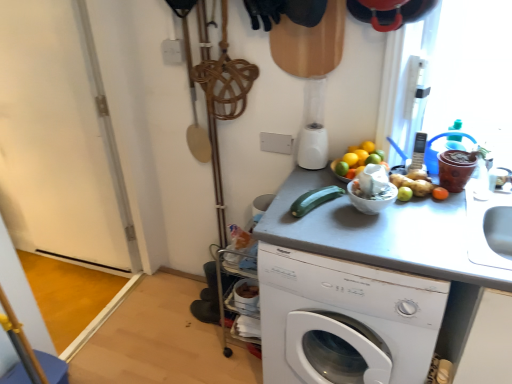
Question: In terms of width, does green matte cucumber at center look wider or thinner when compared to silver metallic phone at upper right?

Choices:
 (A) wide
 (B) thin

Answer: (A)

Question: From a real-world perspective, relative to silver metallic phone at upper right, is green matte cucumber at center vertically above or below?

Choices:
 (A) above
 (B) below

Answer: (B)

Question: Which object is the closest to the white plastic washing machine at center?

Choices:
 (A) gray matte counter top at center
 (B) green matte cucumber at center
 (C) silver metallic phone at upper right
 (D) white glossy bowl at upper right
 (E) orange matte at upper right

Answer: (A)

Question: Which object is positioned farthest from the orange matte at upper right?

Choices:
 (A) gray matte counter top at center
 (B) green matte cucumber at center
 (C) silver metallic phone at upper right
 (D) white plastic washing machine at center
 (E) white glossy bowl at upper right

Answer: (D)